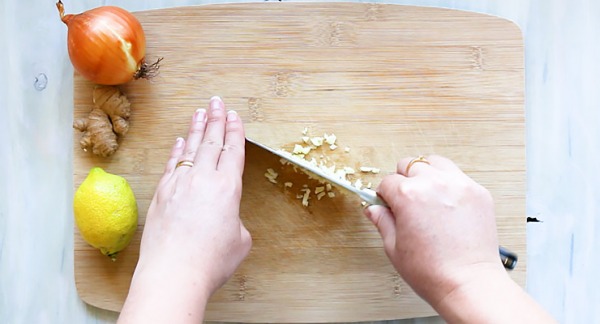
I want to click on light blue table, so click(x=547, y=110).